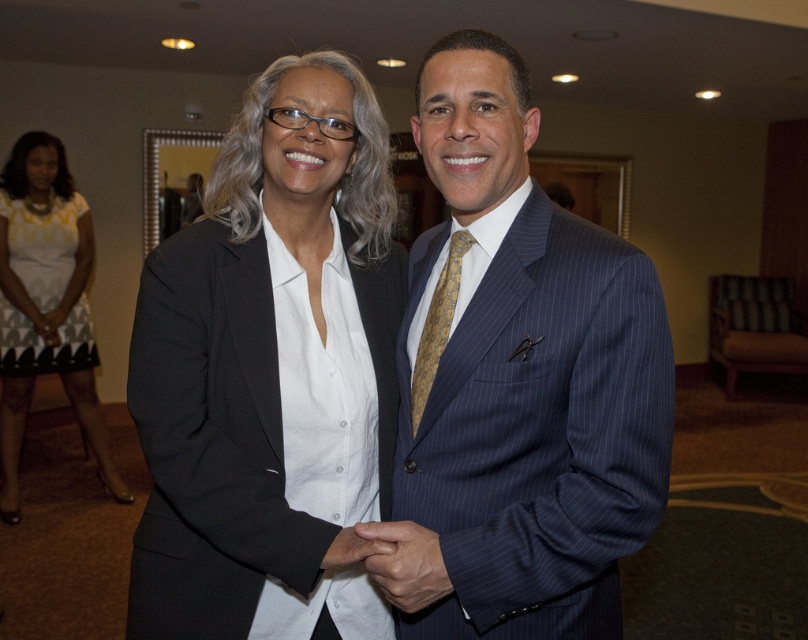
Who is higher up, matte black blazer at center or yellow silk tie at center?

Positioned higher is yellow silk tie at center.

Is matte black blazer at center closer to the viewer compared to yellow silk tie at center?

Yes, it is in front of yellow silk tie at center.

Where is `matte black blazer at center`? This screenshot has width=808, height=640. matte black blazer at center is located at coordinates (271, 372).

Based on the photo, is blue pinstripe suit at center thinner than white dotted dress at lower left?

Yes.

Can you confirm if blue pinstripe suit at center is taller than white dotted dress at lower left?

In fact, blue pinstripe suit at center may be shorter than white dotted dress at lower left.

Does point (442, 90) come closer to viewer compared to point (17, 408)?

That is True.

The height and width of the screenshot is (640, 808). What are the coordinates of `blue pinstripe suit at center` in the screenshot? It's located at (516, 385).

Does white dotted dress at lower left have a lesser height compared to yellow silk tie at center?

In fact, white dotted dress at lower left may be taller than yellow silk tie at center.

Does point (66, 234) come behind point (426, 339)?

Yes, point (66, 234) is behind point (426, 339).

What do you see at coordinates (45, 305) in the screenshot? I see `white dotted dress at lower left` at bounding box center [45, 305].

Where is `white dotted dress at lower left`? white dotted dress at lower left is located at coordinates (45, 305).